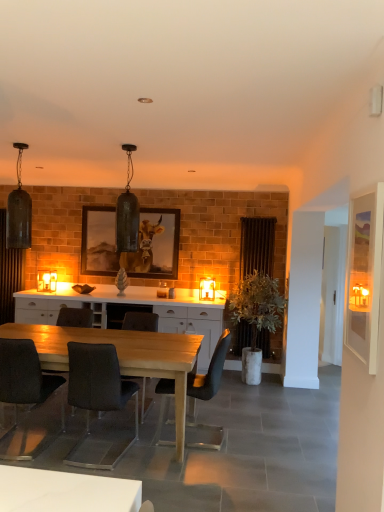
Find the location of a particular element. This screenshot has width=384, height=512. vacant area on top of metallic glass pendant light at center, which appears as the second lamp when viewed from the right (from a real-world perspective) is located at coordinates (139, 143).